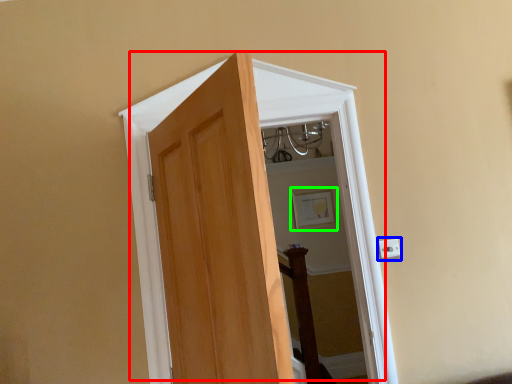
Question: Considering the real-world distances, which object is closest to door (highlighted by a red box)? electric outlet (highlighted by a blue box) or picture frame (highlighted by a green box).

Choices:
 (A) electric outlet
 (B) picture frame

Answer: (A)